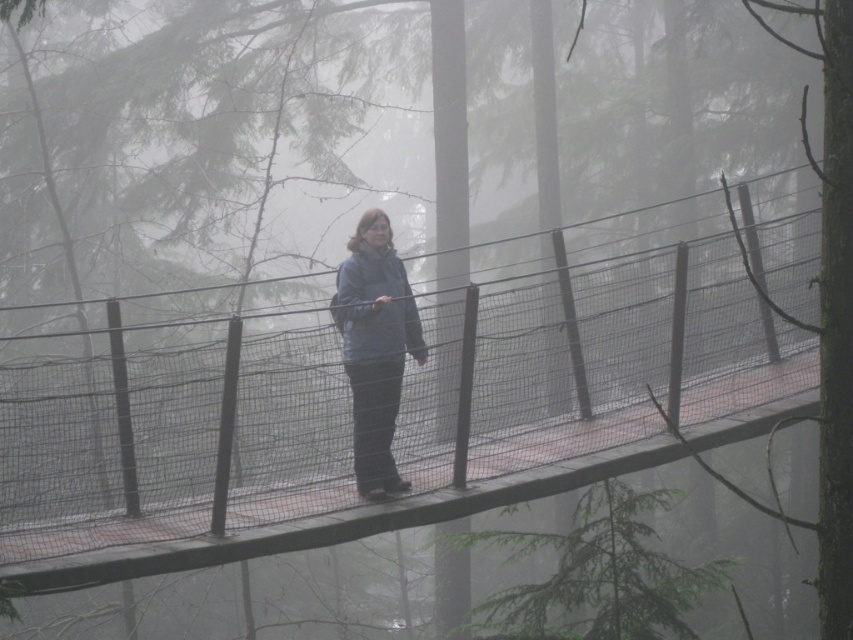
You are standing on the suspension bridge in the misty forest. You notice the wooden at center and the blue matte jacket at center. Which object is positioned to the right of the other?

The wooden at center is to the right of the blue matte jacket at center.

You are a photographer trying to capture the blue matte jacket at center and the wooden at center in the same frame. Based on their heights, which object should you focus on first to ensure both are in the shot?

The wooden at center is shorter than the blue matte jacket at center, so you should focus on the blue matte jacket at center first to ensure both are in the shot.

You are a photographer trying to capture the wooden at center and the blue matte jacket at center in a single frame. Based on their sizes, which object should you focus on first to ensure both are in focus?

The wooden at center is smaller than the blue matte jacket at center, so you should focus on the blue matte jacket at center first to ensure both are in focus.